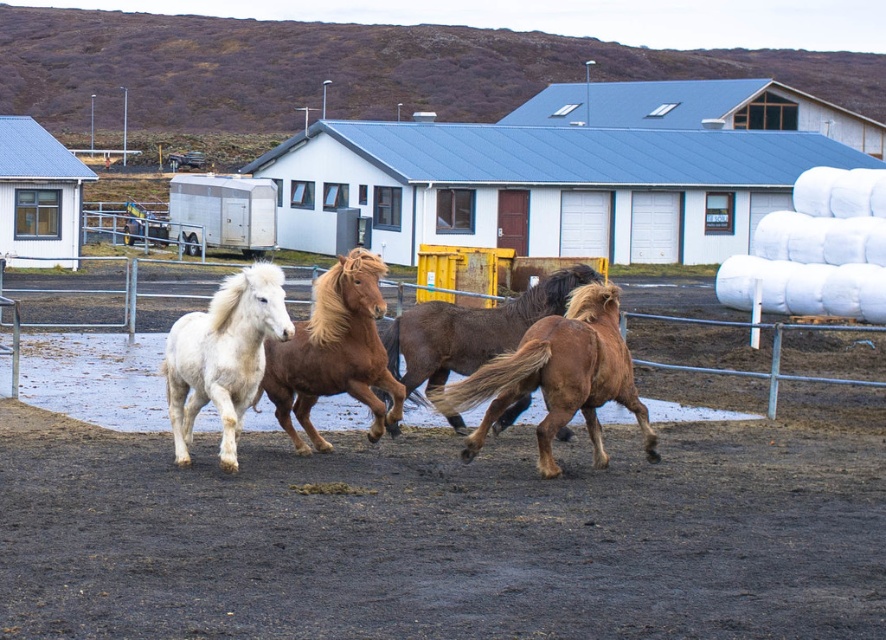
Between brown fuzzy horse at center and brown silky horse at center, which one has less height?

With less height is brown fuzzy horse at center.

Which is behind, point (573, 394) or point (343, 336)?

The point (343, 336) is more distant.

Where is `brown fuzzy horse at center`? brown fuzzy horse at center is located at coordinates (557, 378).

Between damp brown dirt at center and white fluffy horse at left, which one is positioned lower?

Positioned lower is damp brown dirt at center.

How distant is damp brown dirt at center from white fluffy horse at left?

The distance of damp brown dirt at center from white fluffy horse at left is 8.19 feet.

Is point (580, 474) positioned before point (265, 320)?

No, (580, 474) is further to viewer.

At what (x,y) coordinates should I click in order to perform the action: click on damp brown dirt at center. Please return your answer as a coordinate pair (x, y). Looking at the image, I should click on (441, 536).

Consider the image. Between brown fuzzy horse at center and white fluffy horse at left, which one appears on the left side from the viewer's perspective?

From the viewer's perspective, white fluffy horse at left appears more on the left side.

Looking at this image, does brown fuzzy horse at center appear on the right side of white fluffy horse at left?

Correct, you'll find brown fuzzy horse at center to the right of white fluffy horse at left.

I want to click on brown fuzzy horse at center, so click(557, 378).

The width and height of the screenshot is (886, 640). I want to click on brown fuzzy horse at center, so click(557, 378).